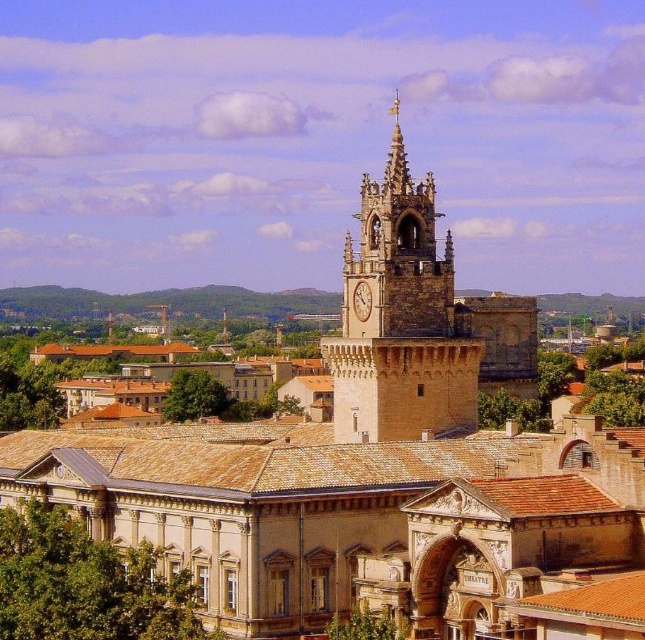
Question: Which point is closer to the camera?

Choices:
 (A) (364, 308)
 (B) (466, 420)

Answer: (B)

Question: Is stone clock tower at center behind gold textured clock at center?

Choices:
 (A) no
 (B) yes

Answer: (A)

Question: Can you confirm if stone clock tower at center is thinner than gold textured clock at center?

Choices:
 (A) no
 (B) yes

Answer: (A)

Question: Can you confirm if stone clock tower at center is thinner than gold textured clock at center?

Choices:
 (A) yes
 (B) no

Answer: (B)